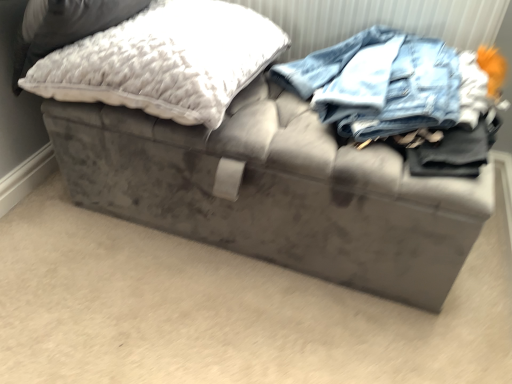
Question: Is white fluffy pillow at upper left, positioned as the 1th pillow in left-to-right order, to the left or to the right of white fluffy pillow at upper left, which is counted as the 2th pillow, starting from the left, in the image?

Choices:
 (A) right
 (B) left

Answer: (B)

Question: Is point (34, 41) closer or farther from the camera than point (244, 79)?

Choices:
 (A) farther
 (B) closer

Answer: (B)

Question: From a real-world perspective, is white fluffy pillow at upper left, positioned as the 1th pillow in left-to-right order, positioned above or below white fluffy pillow at upper left, which is the 1th pillow from right to left?

Choices:
 (A) above
 (B) below

Answer: (A)

Question: From their relative heights in the image, would you say white fluffy pillow at upper left, which is counted as the 2th pillow, starting from the left, is taller or shorter than white fluffy pillow at upper left, positioned as the 1th pillow in left-to-right order?

Choices:
 (A) tall
 (B) short

Answer: (A)

Question: From a real-world perspective, is white fluffy pillow at upper left, which is the 1th pillow from right to left, physically located above or below white fluffy pillow at upper left, positioned as the 1th pillow in left-to-right order?

Choices:
 (A) below
 (B) above

Answer: (A)

Question: From the image's perspective, is white fluffy pillow at upper left, which is the 1th pillow from right to left, positioned above or below white fluffy pillow at upper left, which is the second pillow in right-to-left order?

Choices:
 (A) below
 (B) above

Answer: (A)

Question: Looking at their shapes, would you say white fluffy pillow at upper left, which is the 1th pillow from right to left, is wider or thinner than white fluffy pillow at upper left, which is the second pillow in right-to-left order?

Choices:
 (A) wide
 (B) thin

Answer: (B)